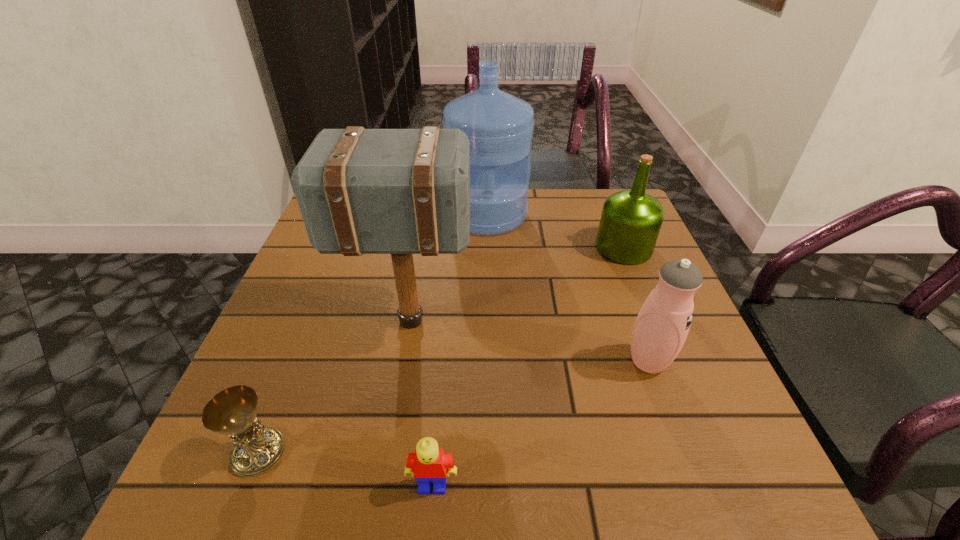
You are a GUI agent. You are given a task and a screenshot of the screen. Output one action in this format:
    pyautogui.click(x=<x>, y=<y>)
    Task: Click on the object at the far right corner
    The width and height of the screenshot is (960, 540).
    Given the screenshot: What is the action you would take?
    pyautogui.click(x=630, y=222)

This screenshot has width=960, height=540. What are the coordinates of `free spot at the far edge of the desktop` in the screenshot? It's located at (551, 195).

Locate an element on the screen. The height and width of the screenshot is (540, 960). free region at the near edge of the desktop is located at coordinates (648, 487).

In the image, there is a desktop. Identify the location of vacant space at the left edge. (295, 273).

In order to click on vacant region at the near left corner in this screenshot , I will do `click(272, 478)`.

Image resolution: width=960 pixels, height=540 pixels. In the image, there is a desktop. Identify the location of free space at the far right corner. (578, 191).

The image size is (960, 540). In the image, there is a desktop. In order to click on vacant space at the near right corner in this screenshot , I will do `click(708, 492)`.

Locate an element on the screen. free space between the Lego and the thermos bottle is located at coordinates click(x=540, y=423).

At what (x,y) coordinates should I click in order to perform the action: click on free space between the Lego and the water jug. Please return your answer as a coordinate pair (x, y). Looking at the image, I should click on (460, 350).

At what (x,y) coordinates should I click in order to perform the action: click on vacant area that lies between the chalice and the water jug. Please return your answer as a coordinate pair (x, y). Looking at the image, I should click on (373, 334).